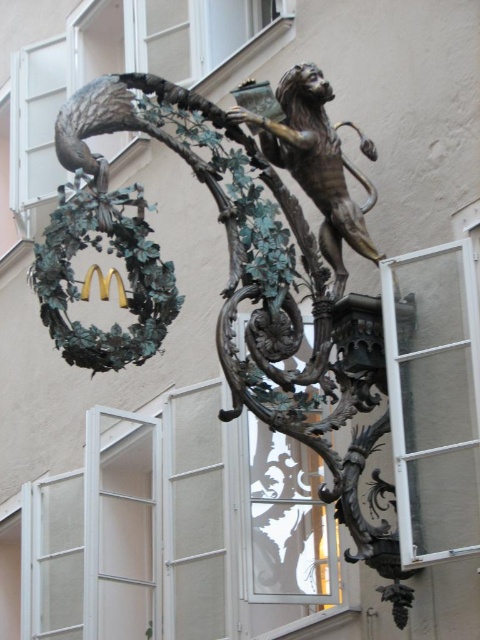
Question: In this image, where is bronze sculpture at center located relative to clear glass window at right?

Choices:
 (A) below
 (B) above

Answer: (B)

Question: Is bronze sculpture at center thinner than clear glass window at right?

Choices:
 (A) no
 (B) yes

Answer: (A)

Question: Among these objects, which one is nearest to the camera?

Choices:
 (A) clear glass window at right
 (B) bronze sculpture at center

Answer: (A)

Question: In this image, where is bronze sculpture at center located relative to clear glass window at right?

Choices:
 (A) left
 (B) right

Answer: (A)

Question: Which of the following is the closest to the observer?

Choices:
 (A) (444, 396)
 (B) (347, 512)

Answer: (A)